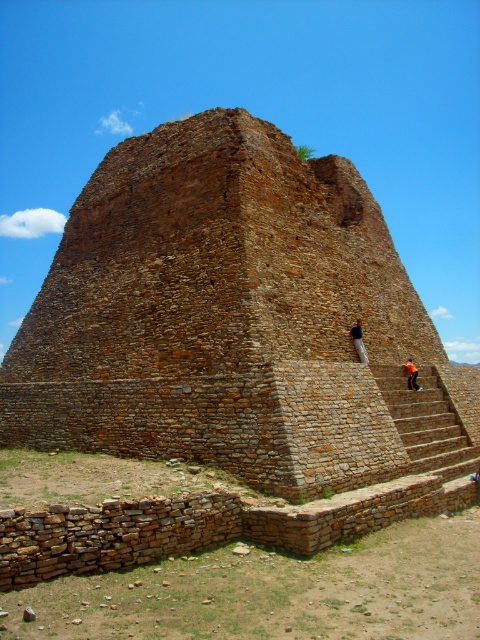
Does dark brown stone person at upper center have a greater height compared to orange fabric person at upper right?

Yes.

Is point (359, 328) more distant than point (408, 364)?

No, it is not.

Who is more distant from viewer, (359, 342) or (410, 376)?

Positioned behind is point (410, 376).

Image resolution: width=480 pixels, height=640 pixels. Identify the location of dark brown stone person at upper center. (359, 340).

Between point (151, 301) and point (365, 360), which one is positioned behind?

The point (365, 360) is more distant.

From the picture: Does brown stone ruins at center have a greater height compared to dark brown stone person at upper center?

Yes.

Where is `brown stone ruins at center`? The height and width of the screenshot is (640, 480). brown stone ruins at center is located at coordinates (219, 314).

The height and width of the screenshot is (640, 480). In order to click on brown stone ruins at center in this screenshot , I will do `click(219, 314)`.

Does brown stone ruins at center appear on the left side of orange fabric person at upper right?

Correct, you'll find brown stone ruins at center to the left of orange fabric person at upper right.

Does brown stone ruins at center appear under orange fabric person at upper right?

Incorrect, brown stone ruins at center is not positioned below orange fabric person at upper right.

Describe the element at coordinates (219, 314) in the screenshot. I see `brown stone ruins at center` at that location.

Where is `brown stone ruins at center`? The image size is (480, 640). brown stone ruins at center is located at coordinates (219, 314).